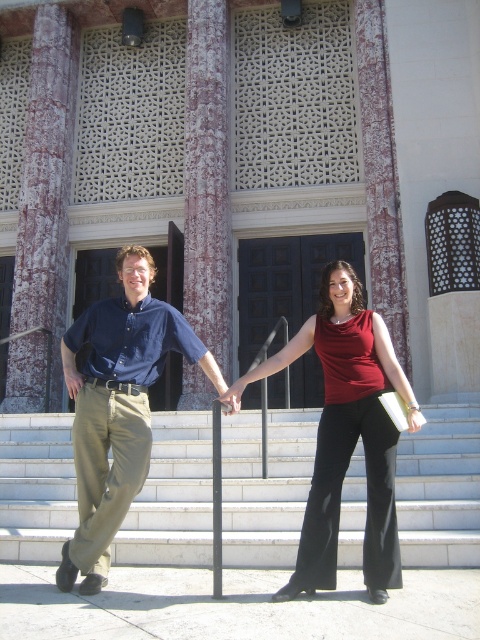
Question: Which point is closer to the camera taking this photo?

Choices:
 (A) (169, 339)
 (B) (357, 435)

Answer: (B)

Question: Can you confirm if matte red blouse at center is positioned to the right of matte blue shirt at left?

Choices:
 (A) yes
 (B) no

Answer: (A)

Question: Does matte blue shirt at center appear on the right side of metallic pole at center?

Choices:
 (A) yes
 (B) no

Answer: (B)

Question: Which object appears closest to the camera in this image?

Choices:
 (A) matte red blouse at center
 (B) matte blue shirt at center
 (C) white concrete stairs at center

Answer: (A)

Question: Can you confirm if matte blue shirt at left is positioned above metallic pole at center?

Choices:
 (A) no
 (B) yes

Answer: (B)

Question: Which object is closer to the camera taking this photo?

Choices:
 (A) matte blue shirt at center
 (B) matte red blouse at center
 (C) matte blue shirt at left
 (D) metallic pole at center

Answer: (B)